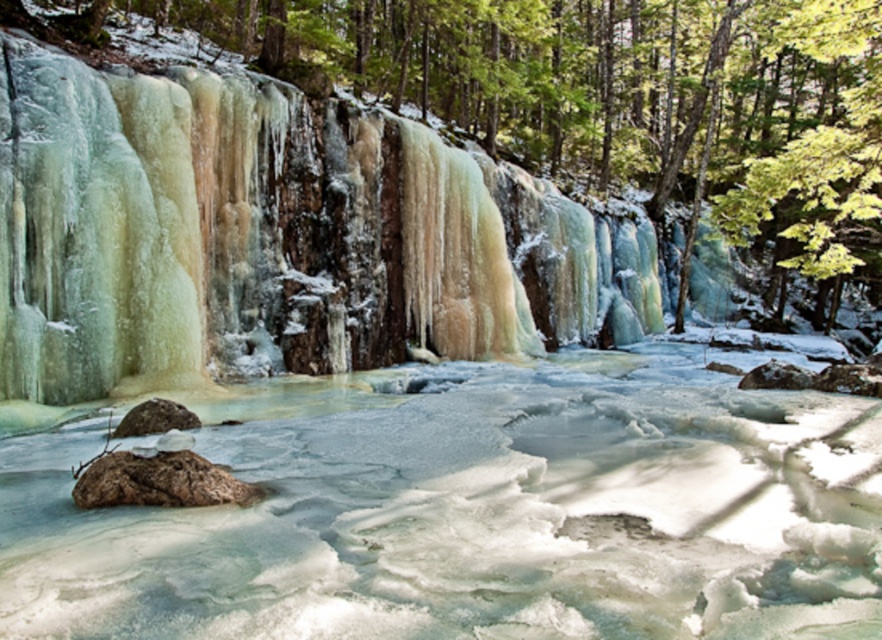
Question: Among these objects, which one is nearest to the camera?

Choices:
 (A) translucent ice water at center
 (B) icy translucent waterfall at center
 (C) brown rough rock at lower left
 (D) brown rough rock at center

Answer: (A)

Question: Which point appears farthest from the camera in this image?

Choices:
 (A) (155, 349)
 (B) (629, 481)
 (C) (163, 420)
 (D) (168, 481)

Answer: (A)

Question: Can you confirm if translucent ice water at center is positioned below brown rough rock at lower left?

Choices:
 (A) yes
 (B) no

Answer: (A)

Question: Does brown rough rock at lower left appear under brown rough rock at center?

Choices:
 (A) yes
 (B) no

Answer: (A)

Question: Can you confirm if icy translucent waterfall at center is smaller than brown rough rock at lower left?

Choices:
 (A) yes
 (B) no

Answer: (B)

Question: Which is nearer to the brown rough rock at center?

Choices:
 (A) brown rough rock at lower left
 (B) icy translucent waterfall at center

Answer: (A)